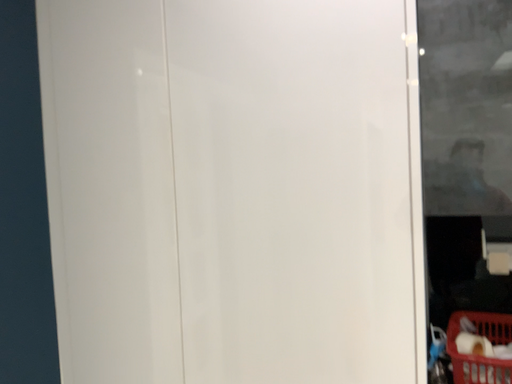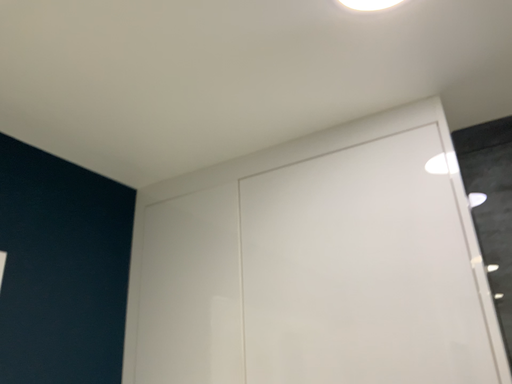
Question: Which way did the camera rotate in the video?

Choices:
 (A) rotated upward
 (B) rotated downward

Answer: (A)